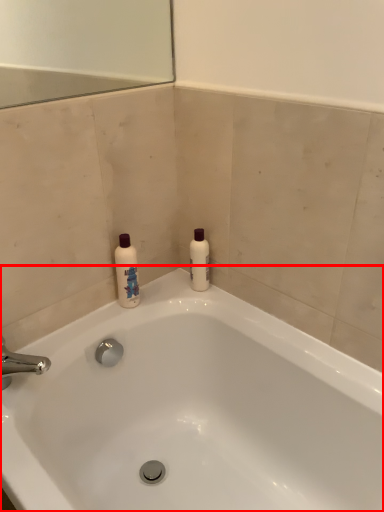
Question: From the image's perspective, where is bathtub (annotated by the red box) located relative to cleaning product?

Choices:
 (A) below
 (B) above

Answer: (A)